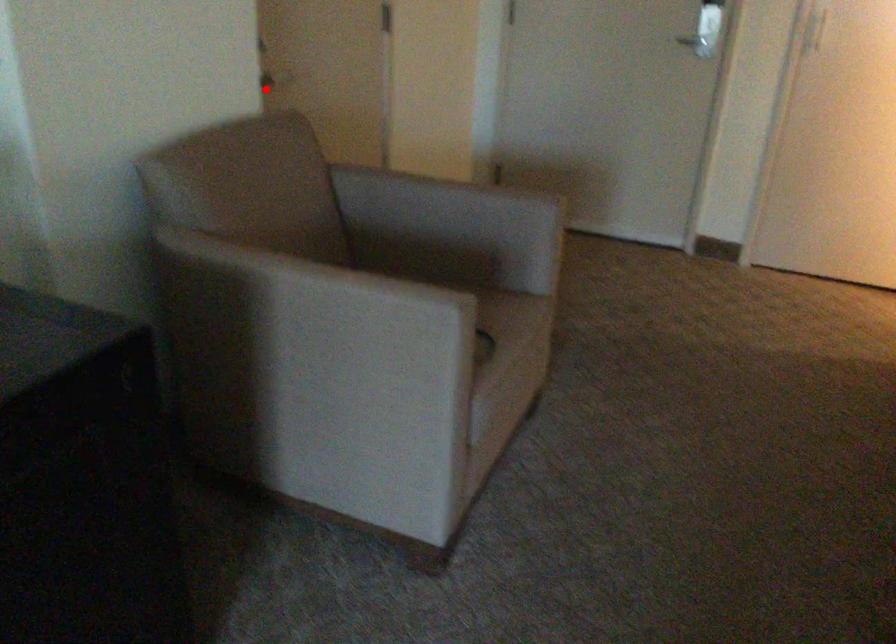
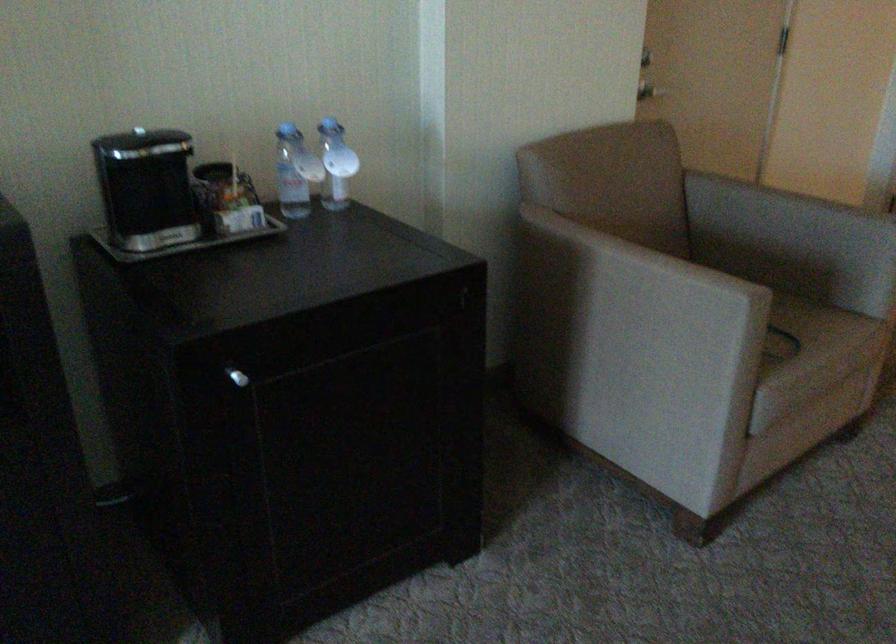
Where in the second image is the point corresponding to the highlighted location from the first image?

(649, 90)